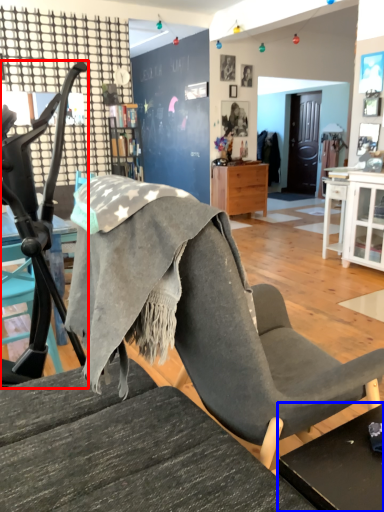
Question: Which of the following is the closest to the observer, chair (highlighted by a red box) or table (highlighted by a blue box)?

Choices:
 (A) chair
 (B) table

Answer: (B)